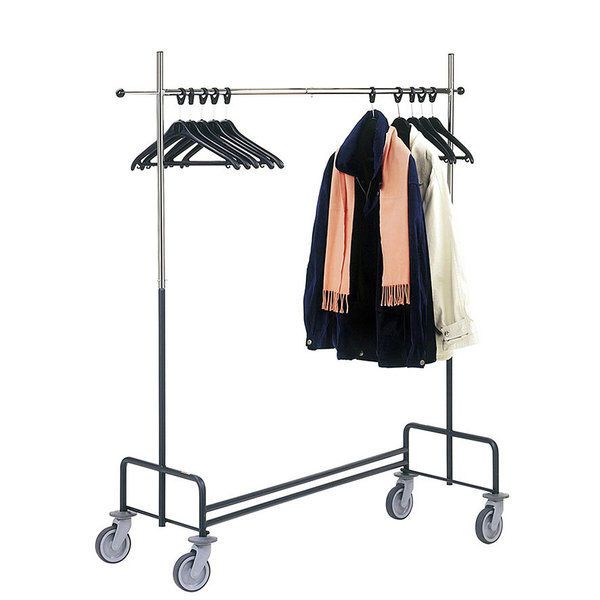
Identify the location of hangers. This screenshot has height=600, width=600. click(x=185, y=131), click(x=204, y=132), click(x=217, y=130), click(x=237, y=130), click(x=436, y=139), click(x=450, y=152), click(x=459, y=143), click(x=367, y=103), click(x=399, y=107), click(x=203, y=112).